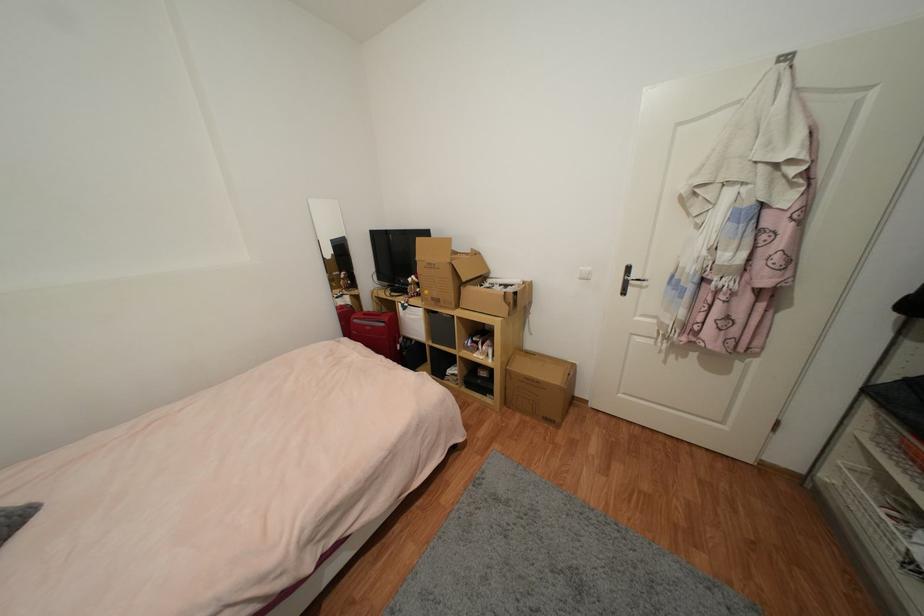
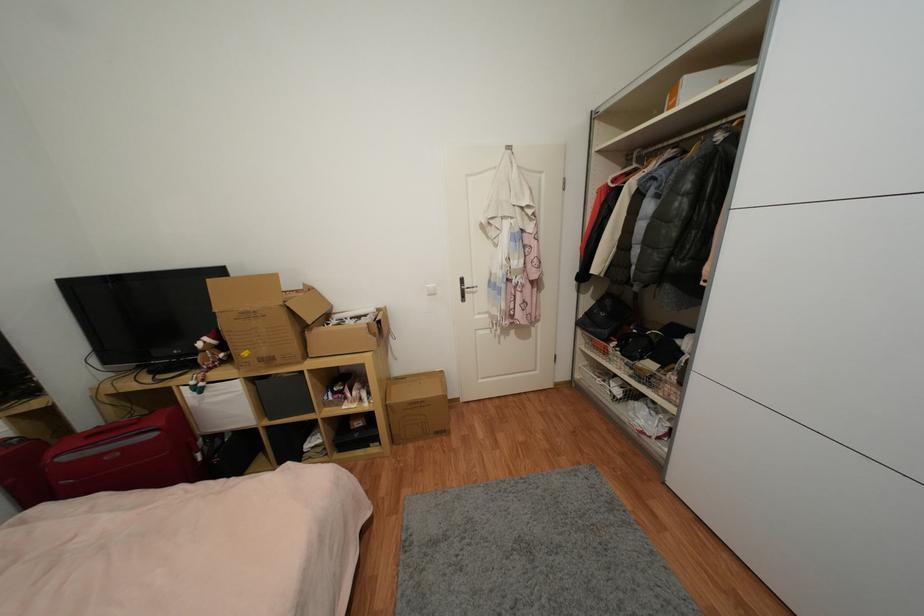
In the second image, find the point that corresponds to point (509, 403) in the first image.

(397, 440)